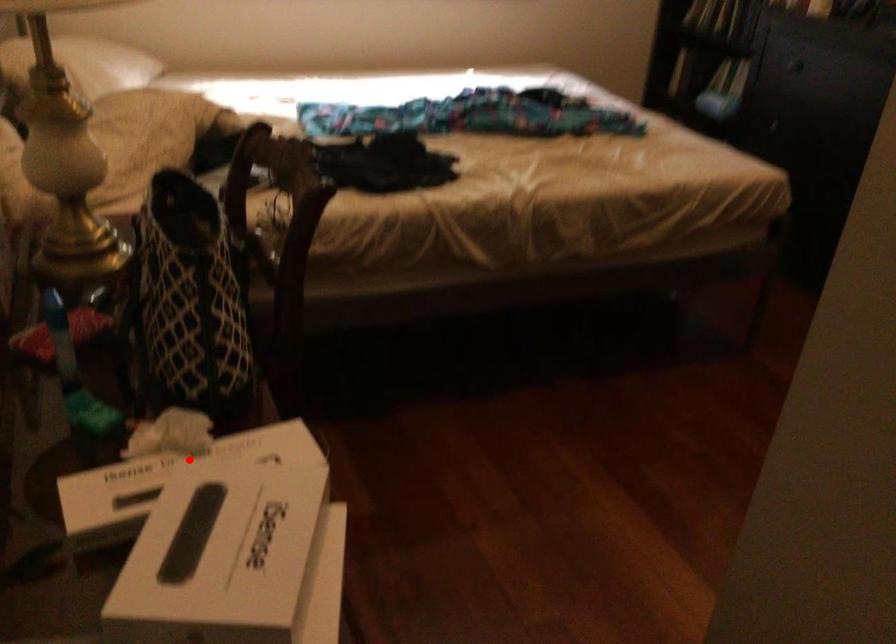
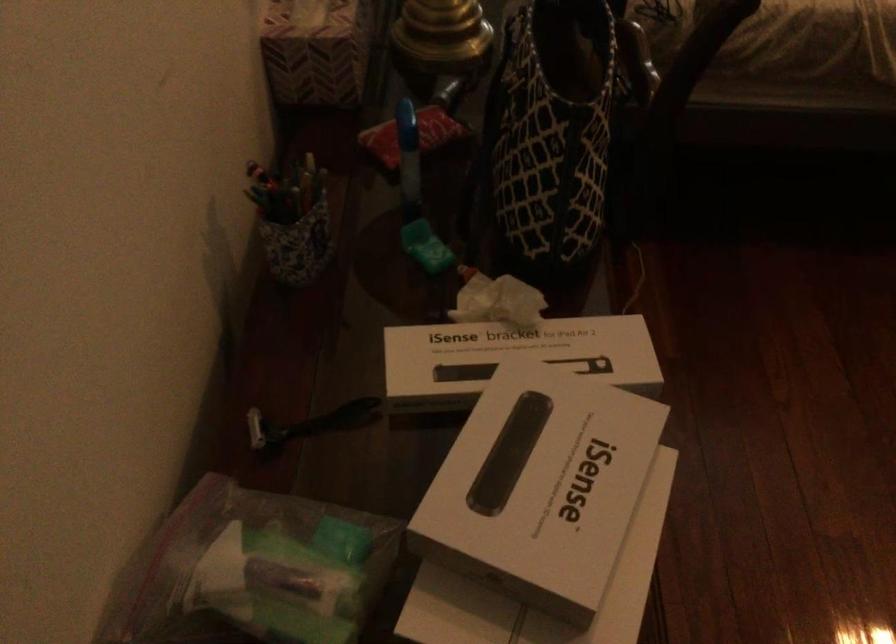
The point at the highlighted location is marked in the first image. Where is the corresponding point in the second image?

(515, 353)